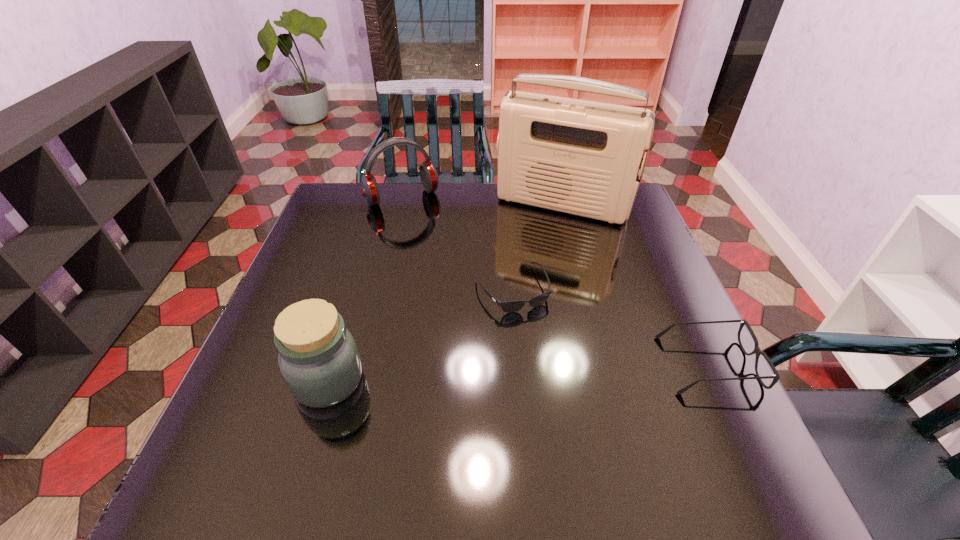
The width and height of the screenshot is (960, 540). In order to click on earphone that is at the far edge in this screenshot , I will do `click(429, 177)`.

The width and height of the screenshot is (960, 540). What are the coordinates of `object located at the near edge` in the screenshot? It's located at (319, 360).

Where is `jar located at the left edge`? jar located at the left edge is located at coordinates (319, 360).

Locate an element on the screen. This screenshot has height=540, width=960. earphone located at the left edge is located at coordinates (429, 177).

Where is `spectacles that is at the right edge`? This screenshot has width=960, height=540. spectacles that is at the right edge is located at coordinates (757, 351).

Find the location of a particular element. radio receiver present at the right edge is located at coordinates (581, 157).

Find the location of a particular element. This screenshot has height=540, width=960. object located in the far left corner section of the desktop is located at coordinates (429, 177).

Locate an element on the screen. The height and width of the screenshot is (540, 960). object located in the near left corner section of the desktop is located at coordinates point(319,360).

Locate an element on the screen. object that is at the far right corner is located at coordinates (581, 157).

This screenshot has width=960, height=540. Find the location of `blank space at the far edge of the desktop`. blank space at the far edge of the desktop is located at coordinates (384, 212).